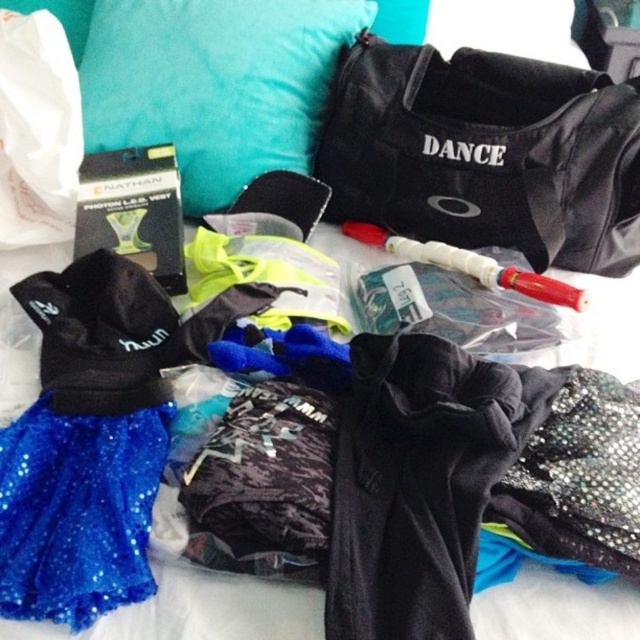
Question: Which point appears closest to the camera in this image?

Choices:
 (A) (225, 38)
 (B) (358, 92)
 (C) (54, 448)

Answer: (C)

Question: Does black fabric duffel at upper right have a greater width compared to teal fabric pillow at upper left?

Choices:
 (A) no
 (B) yes

Answer: (B)

Question: Estimate the real-world distances between objects in this image. Which object is closer to the sparkly blue skirt at lower left?

Choices:
 (A) black fabric duffel at upper right
 (B) teal fabric pillow at upper left

Answer: (B)

Question: Based on their relative distances, which object is nearer to the teal fabric pillow at upper left?

Choices:
 (A) sparkly blue skirt at lower left
 (B) black fabric duffel at upper right

Answer: (B)

Question: From the image, what is the correct spatial relationship of black fabric duffel at upper right in relation to sparkly blue skirt at lower left?

Choices:
 (A) right
 (B) left

Answer: (A)

Question: Does teal fabric pillow at upper left have a lesser width compared to sparkly blue skirt at lower left?

Choices:
 (A) no
 (B) yes

Answer: (A)